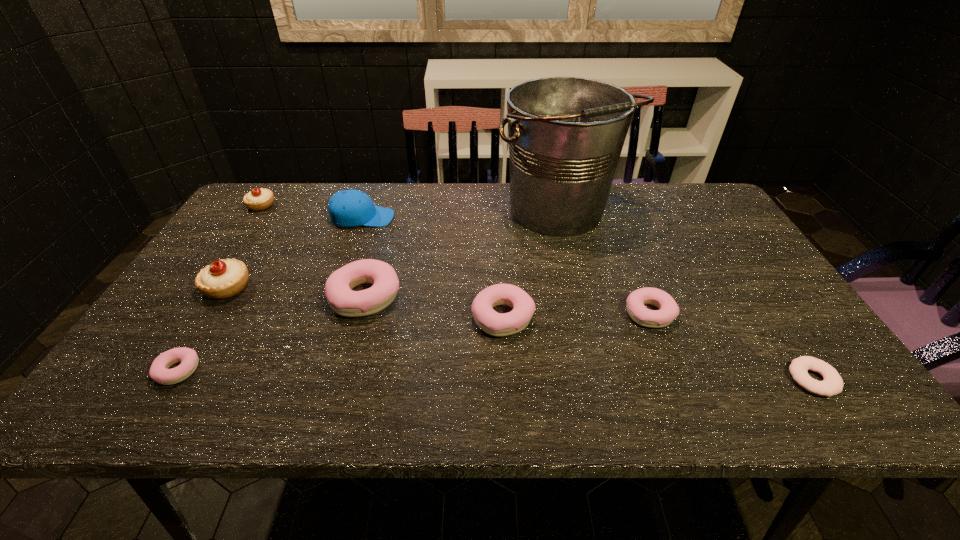
You are a GUI agent. You are given a task and a screenshot of the screen. Output one action in this format:
    pyautogui.click(x=<x>, y=<y>)
    Task: Click on the vacant space located 0.100m on the back of the biggest pink pastry
    This screenshot has height=540, width=960.
    Given the screenshot: What is the action you would take?
    pyautogui.click(x=378, y=249)

Where is `vacant space situated on the right of the second pastry from right to left`? vacant space situated on the right of the second pastry from right to left is located at coordinates (618, 317).

The image size is (960, 540). Identify the location of vacant space located 0.110m on the left of the seventh tallest object. (580, 313).

Image resolution: width=960 pixels, height=540 pixels. I want to click on free space located on the right of the smallest pink pastry, so click(325, 370).

You are a GUI agent. You are given a task and a screenshot of the screen. Output one action in this format:
    pyautogui.click(x=<x>, y=<y>)
    Task: Click on the vacant space located 0.130m on the back of the rightmost object
    This screenshot has height=540, width=960.
    Given the screenshot: What is the action you would take?
    coord(771,316)

This screenshot has width=960, height=540. What are the coordinates of `bucket that is at the far edge` in the screenshot? It's located at [566, 134].

Locate an element on the screen. cap present at the far edge is located at coordinates (347, 208).

The height and width of the screenshot is (540, 960). Find the location of `pastry that is at the far edge`. pastry that is at the far edge is located at coordinates (258, 199).

This screenshot has height=540, width=960. Identify the location of pastry located in the near edge section of the desktop. (159, 372).

Locate an element on the screen. This screenshot has height=540, width=960. doughnut at the near edge is located at coordinates (832, 384).